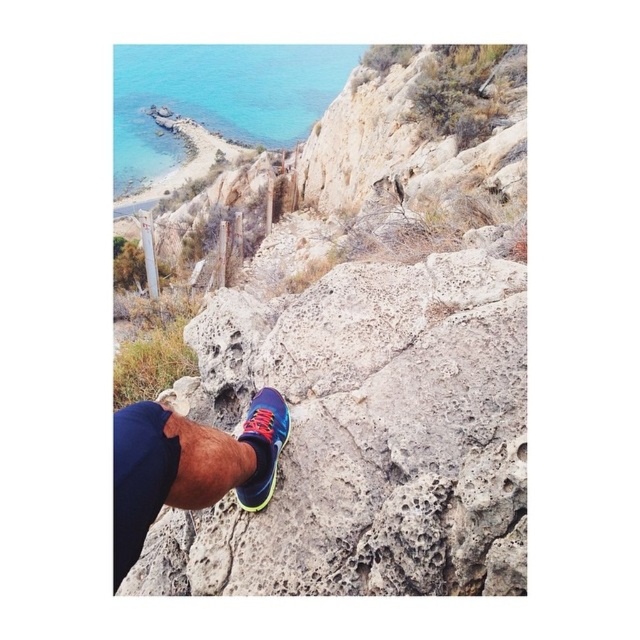
Question: Which of the following is the closest to the observer?

Choices:
 (A) (436, 417)
 (B) (296, 134)
 (C) (168, 456)
 (D) (257, 509)

Answer: (C)

Question: Which of these objects is positioned farthest from the shiny blue running shoe at center?

Choices:
 (A) shiny blue running shoe at lower center
 (B) rough textured rock at center
 (C) turquoise glossy water at upper left

Answer: (C)

Question: Which object is closer to the camera taking this photo?

Choices:
 (A) shiny blue running shoe at center
 (B) rough textured rock at center

Answer: (A)

Question: Does rough textured rock at center appear over shiny blue running shoe at center?

Choices:
 (A) no
 (B) yes

Answer: (B)

Question: Is rough textured rock at center closer to the viewer compared to turquoise glossy water at upper left?

Choices:
 (A) no
 (B) yes

Answer: (B)

Question: Observing the image, what is the correct spatial positioning of rough textured rock at center in reference to turquoise glossy water at upper left?

Choices:
 (A) above
 (B) below

Answer: (B)